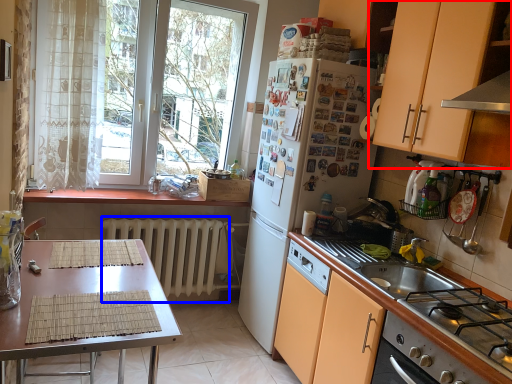
Question: Which of the following is the farthest to the observer, cabinetry (highlighted by a red box) or radiator (highlighted by a blue box)?

Choices:
 (A) cabinetry
 (B) radiator

Answer: (B)